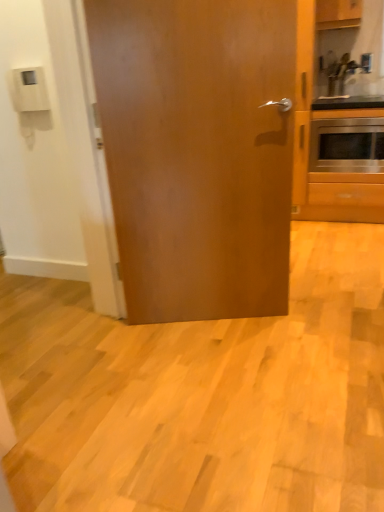
Question: Is glossy wood door at center shorter than stainless steel oven at right?

Choices:
 (A) yes
 (B) no

Answer: (B)

Question: Is glossy wood door at center to the left of stainless steel oven at right from the viewer's perspective?

Choices:
 (A) no
 (B) yes

Answer: (B)

Question: From a real-world perspective, does glossy wood door at center sit lower than stainless steel oven at right?

Choices:
 (A) yes
 (B) no

Answer: (B)

Question: Does glossy wood door at center come in front of stainless steel oven at right?

Choices:
 (A) no
 (B) yes

Answer: (B)

Question: Can you see glossy wood door at center touching stainless steel oven at right?

Choices:
 (A) no
 (B) yes

Answer: (A)

Question: From the image's perspective, is glossy wood door at center on stainless steel oven at right?

Choices:
 (A) yes
 (B) no

Answer: (B)

Question: From the image's perspective, is wooden cabinet at upper right under stainless steel oven at right?

Choices:
 (A) yes
 (B) no

Answer: (B)

Question: Is wooden cabinet at upper right not close to stainless steel oven at right?

Choices:
 (A) yes
 (B) no

Answer: (B)

Question: Is wooden cabinet at upper right positioned behind stainless steel oven at right?

Choices:
 (A) no
 (B) yes

Answer: (A)

Question: Is wooden cabinet at upper right looking in the opposite direction of stainless steel oven at right?

Choices:
 (A) no
 (B) yes

Answer: (A)

Question: Is wooden cabinet at upper right bigger than stainless steel oven at right?

Choices:
 (A) yes
 (B) no

Answer: (B)

Question: From a real-world perspective, is wooden cabinet at upper right located higher than stainless steel oven at right?

Choices:
 (A) yes
 (B) no

Answer: (A)

Question: Is metallic silver sink at upper right positioned far away from stainless steel oven at right?

Choices:
 (A) yes
 (B) no

Answer: (B)